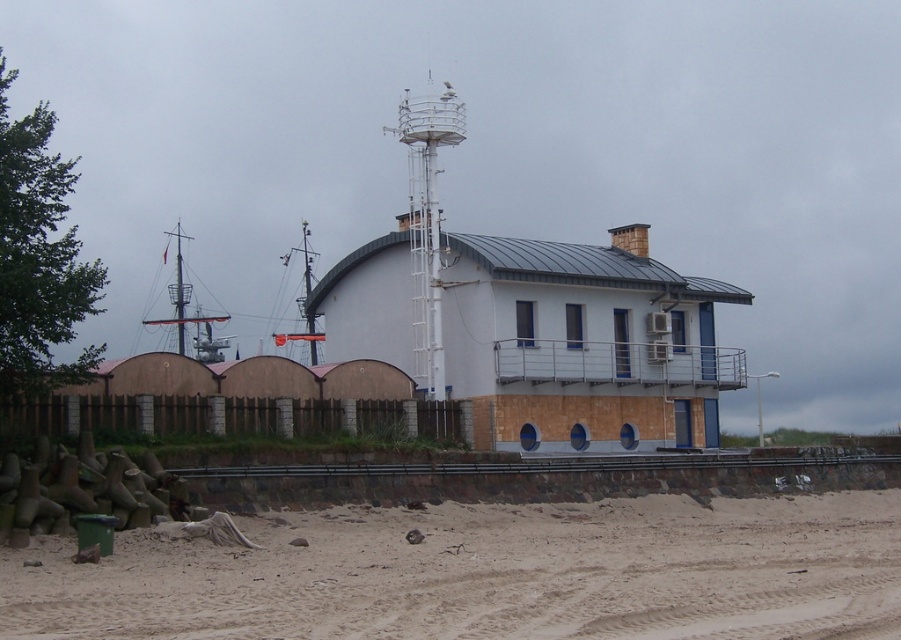
Measure the distance between point (161, 548) and camera.

Point (161, 548) is 29.69 meters from camera.

Can you confirm if brown sandy dirt at lower center is wider than white metallic mast at upper center?

Yes.

Where is `brown sandy dirt at lower center`? brown sandy dirt at lower center is located at coordinates (487, 573).

Where is `brown sandy dirt at lower center`? The height and width of the screenshot is (640, 901). brown sandy dirt at lower center is located at coordinates (487, 573).

Between point (806, 540) and point (603, 268), which one is positioned in front?

Point (806, 540) is in front.

From the picture: Which is more to the left, brown sandy dirt at lower center or white painted wood hut at center?

white painted wood hut at center

From the picture: Who is more distant from viewer, (x=407, y=612) or (x=370, y=330)?

The point (x=370, y=330) is behind.

Locate an element on the screen. This screenshot has width=901, height=640. brown sandy dirt at lower center is located at coordinates (487, 573).

In the scene shown: Who is more forward, (x=742, y=598) or (x=180, y=268)?

Point (x=742, y=598) is more forward.

Is point (595, 512) farther from viewer compared to point (179, 305)?

No, it is in front of (179, 305).

Locate an element on the screen. The height and width of the screenshot is (640, 901). brown sandy dirt at lower center is located at coordinates (487, 573).